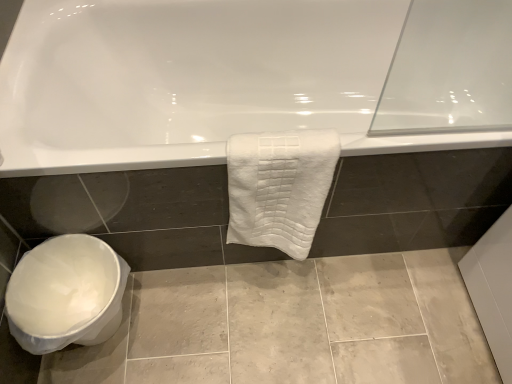
The image size is (512, 384). What do you see at coordinates (194, 81) in the screenshot? I see `white glossy bathtub at upper center` at bounding box center [194, 81].

At what (x,y) coordinates should I click in order to perform the action: click on gray marble tile at lower left. Please return your answer as a coordinate pair (x, y). The image size is (512, 384). Looking at the image, I should click on (292, 325).

The width and height of the screenshot is (512, 384). Find the location of `bathtub that appears in front of the white plastic toilet bowl at lower left`. bathtub that appears in front of the white plastic toilet bowl at lower left is located at coordinates tap(194, 81).

Would you say white plastic toilet bowl at lower left is part of white glossy bathtub at upper center's contents?

That's incorrect, white plastic toilet bowl at lower left is not inside white glossy bathtub at upper center.

Which of these two, white glossy bathtub at upper center or white plastic toilet bowl at lower left, is bigger?

white glossy bathtub at upper center.

Which object is closer to the camera taking this photo, white glossy bathtub at upper center or white plastic toilet bowl at lower left?

white glossy bathtub at upper center is in front.

From the image's perspective, is white plastic toilet bowl at lower left above or below white glossy bathtub at upper center?

Based on their image positions, white plastic toilet bowl at lower left is located beneath white glossy bathtub at upper center.

Is white plastic toilet bowl at lower left looking in the opposite direction of white glossy bathtub at upper center?

No, white plastic toilet bowl at lower left is not facing away from white glossy bathtub at upper center.

What's the angular difference between white plastic toilet bowl at lower left and white glossy bathtub at upper center's facing directions?

There is a 90.5-degree angle between the facing directions of white plastic toilet bowl at lower left and white glossy bathtub at upper center.

Which is closer, (85, 303) or (253, 41)?

Positioned in front is point (85, 303).

Could you tell me if white plastic toilet bowl at lower left is turned towards gray marble tile at lower left?

Yes, white plastic toilet bowl at lower left is aimed at gray marble tile at lower left.

Is white plastic toilet bowl at lower left bigger than gray marble tile at lower left?

Correct, white plastic toilet bowl at lower left is larger in size than gray marble tile at lower left.

In the scene shown: Which object is positioned more to the left, white plastic toilet bowl at lower left or gray marble tile at lower left?

white plastic toilet bowl at lower left.

Can gray marble tile at lower left be found inside white plastic toilet bowl at lower left?

No, gray marble tile at lower left is not a part of white plastic toilet bowl at lower left.

In terms of width, does gray marble tile at lower left look wider or thinner when compared to white plastic toilet bowl at lower left?

Clearly, gray marble tile at lower left has more width compared to white plastic toilet bowl at lower left.

Is gray marble tile at lower left facing away from white plastic toilet bowl at lower left?

gray marble tile at lower left is not turned away from white plastic toilet bowl at lower left.

From the image's perspective, is gray marble tile at lower left located beneath white plastic toilet bowl at lower left?

Yes.

Could gray marble tile at lower left be considered to be inside white textured towel at center?

No.

Is white textured towel at center aimed at gray marble tile at lower left?

No, white textured towel at center is not oriented towards gray marble tile at lower left.

Is white textured towel at center taller or shorter than gray marble tile at lower left?

Considering their sizes, white textured towel at center has more height than gray marble tile at lower left.

Is point (312, 206) closer to viewer compared to point (87, 334)?

No, (312, 206) is behind (87, 334).

Is white textured towel at center surrounding white plastic toilet bowl at lower left?

No, white plastic toilet bowl at lower left is not surrounded by white textured towel at center.

In the scene shown: Considering the sizes of white textured towel at center and white plastic toilet bowl at lower left in the image, is white textured towel at center taller or shorter than white plastic toilet bowl at lower left?

In the image, white textured towel at center appears to be taller than white plastic toilet bowl at lower left.

From a real-world perspective, is white plastic toilet bowl at lower left positioned above or below white textured towel at center?

From a real-world perspective, white plastic toilet bowl at lower left is physically below white textured towel at center.

Does white plastic toilet bowl at lower left lie behind white textured towel at center?

Yes, the depth of white plastic toilet bowl at lower left is greater than that of white textured towel at center.

Consider the image. Can you confirm if white plastic toilet bowl at lower left is positioned to the right of white textured towel at center?

No, white plastic toilet bowl at lower left is not to the right of white textured towel at center.

Is point (74, 319) closer or farther from the camera than point (260, 220)?

Point (74, 319).

At what (x,y) coordinates should I click in order to perform the action: click on bathtub above the white plastic toilet bowl at lower left (from a real-world perspective). Please return your answer as a coordinate pair (x, y). This screenshot has height=384, width=512. Looking at the image, I should click on (194, 81).

In the image, there is a white plastic toilet bowl at lower left. Identify the location of bathtub above it (from the image's perspective). (194, 81).

Which object lies nearer to the anchor point white glossy bathtub at upper center, gray marble tile at lower left or white textured towel at center?

white textured towel at center is positioned closer to the anchor white glossy bathtub at upper center.

Estimate the real-world distances between objects in this image. Which object is closer to white glossy bathtub at upper center, white textured towel at center or gray marble tile at lower left?

white textured towel at center is closer to white glossy bathtub at upper center.

Estimate the real-world distances between objects in this image. Which object is further from white plastic toilet bowl at lower left, white glossy bathtub at upper center or white textured towel at center?

white glossy bathtub at upper center is further to white plastic toilet bowl at lower left.

Considering their positions, is white plastic toilet bowl at lower left positioned closer to white textured towel at center than white glossy bathtub at upper center?

white glossy bathtub at upper center.

Considering their positions, is gray marble tile at lower left positioned further to white textured towel at center than white plastic toilet bowl at lower left?

white plastic toilet bowl at lower left.

Based on the photo, based on their spatial positions, is white textured towel at center or white plastic toilet bowl at lower left closer to white glossy bathtub at upper center?

The object closer to white glossy bathtub at upper center is white textured towel at center.

Estimate the real-world distances between objects in this image. Which object is further from gray marble tile at lower left, white plastic toilet bowl at lower left or white glossy bathtub at upper center?

Based on the image, white glossy bathtub at upper center appears to be further to gray marble tile at lower left.

From the image, which object appears to be nearer to white textured towel at center, white glossy bathtub at upper center or gray marble tile at lower left?

white glossy bathtub at upper center is positioned closer to the anchor white textured towel at center.

Locate an element on the screen. This screenshot has width=512, height=384. towel located between white plastic toilet bowl at lower left and gray marble tile at lower left in the left-right direction is located at coordinates (279, 188).

Find the location of `ceramic tile between white plastic toilet bowl at lower left and white glossy bathtub at upper center`. ceramic tile between white plastic toilet bowl at lower left and white glossy bathtub at upper center is located at coordinates (292, 325).

In order to click on towel between white glossy bathtub at upper center and gray marble tile at lower left in the vertical direction in this screenshot , I will do `click(279, 188)`.

The height and width of the screenshot is (384, 512). I want to click on towel between white plastic toilet bowl at lower left and white glossy bathtub at upper center in the horizontal direction, so click(x=279, y=188).